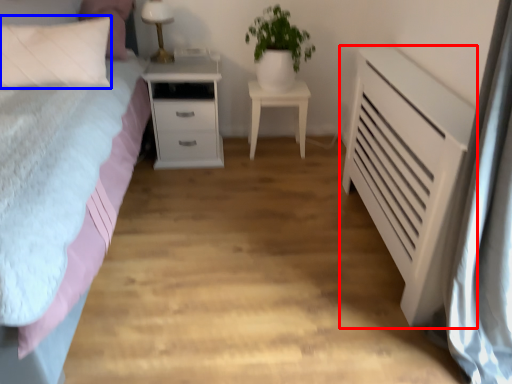
Question: Among these objects, which one is nearest to the camera, chest of drawers (highlighted by a red box) or pillow (highlighted by a blue box)?

Choices:
 (A) chest of drawers
 (B) pillow

Answer: (A)